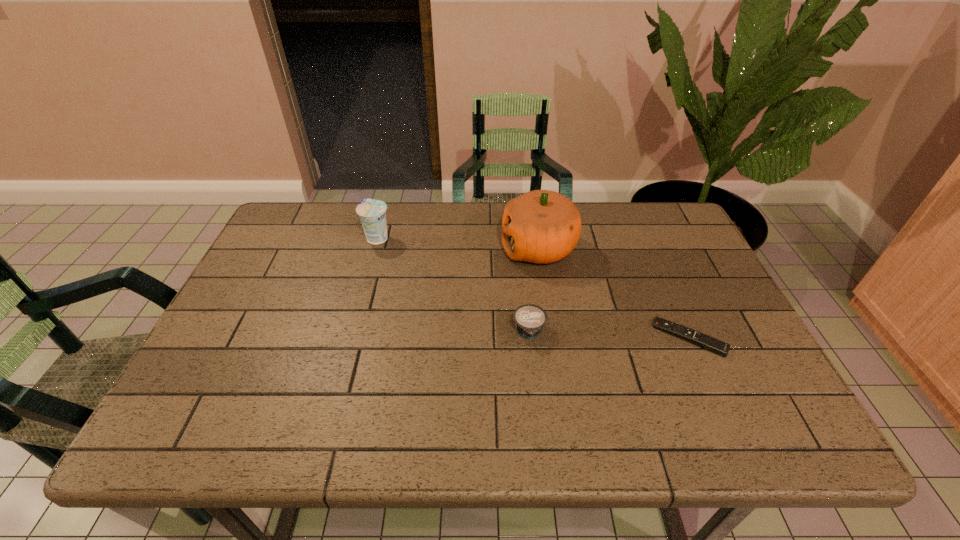
Identify the location of free space that satisfies the following two spatial constraints: 1. on the front side of the nearer yogurt; 2. on the left side of the third shortest object. This screenshot has height=540, width=960. (351, 332).

Locate an element on the screen. This screenshot has height=540, width=960. blank area in the image that satisfies the following two spatial constraints: 1. on the face of the tallest object; 2. on the left side of the rightmost object is located at coordinates click(x=552, y=338).